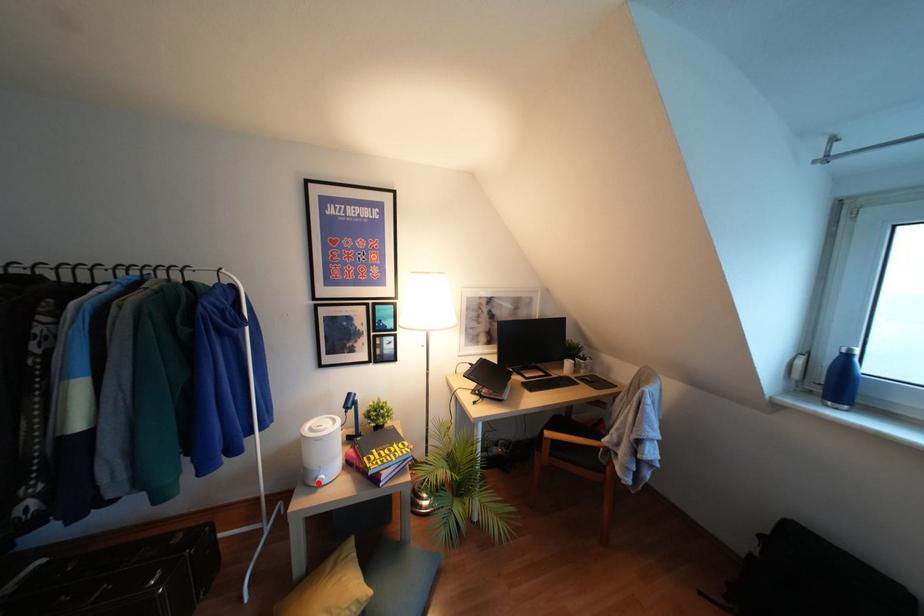
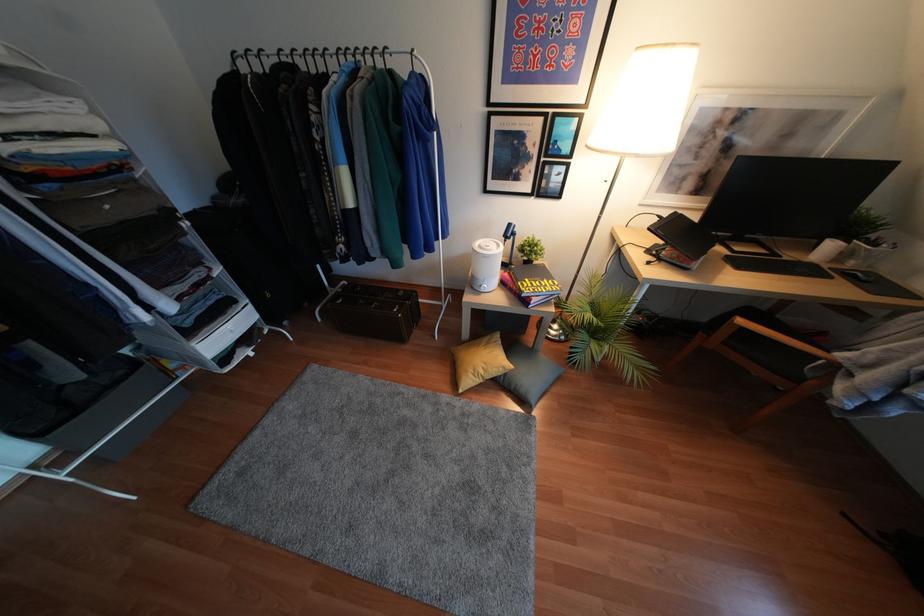
Question: I am providing you with two images of the same scene from different viewpoints. In image1, a red point is highlighted. Considering the same 3D point in image2, which of the following is correct?

Choices:
 (A) It is closer
 (B) It is farther

Answer: (A)